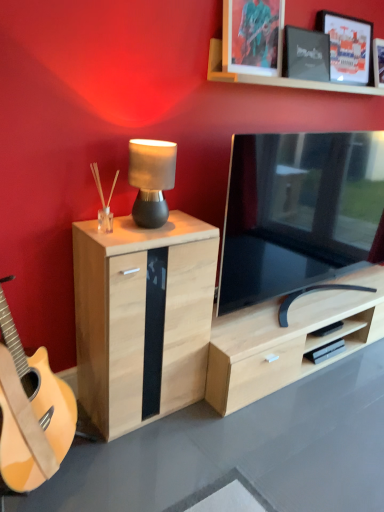
Locate an element on the screen. The width and height of the screenshot is (384, 512). vacant area located to the right-hand side of matte black lamp at center is located at coordinates (187, 224).